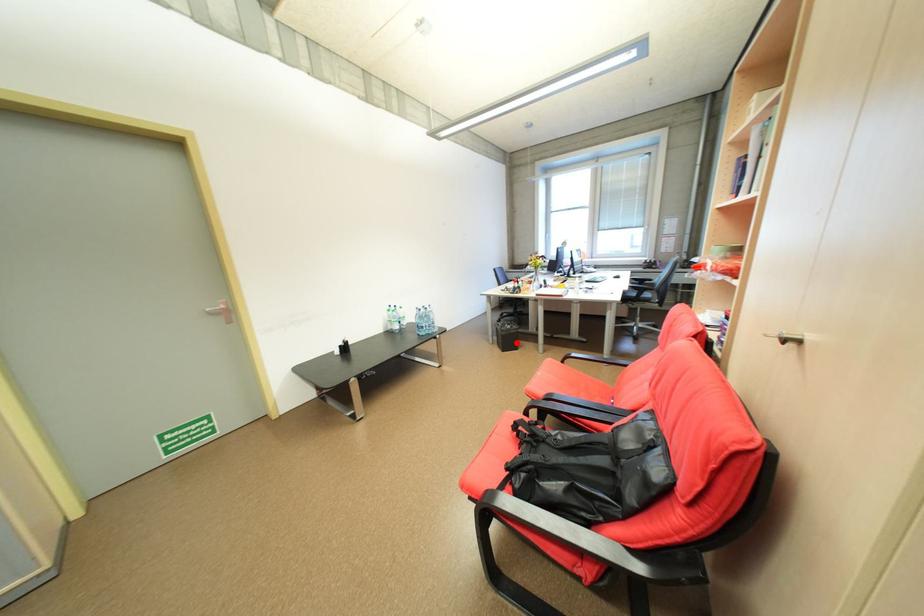
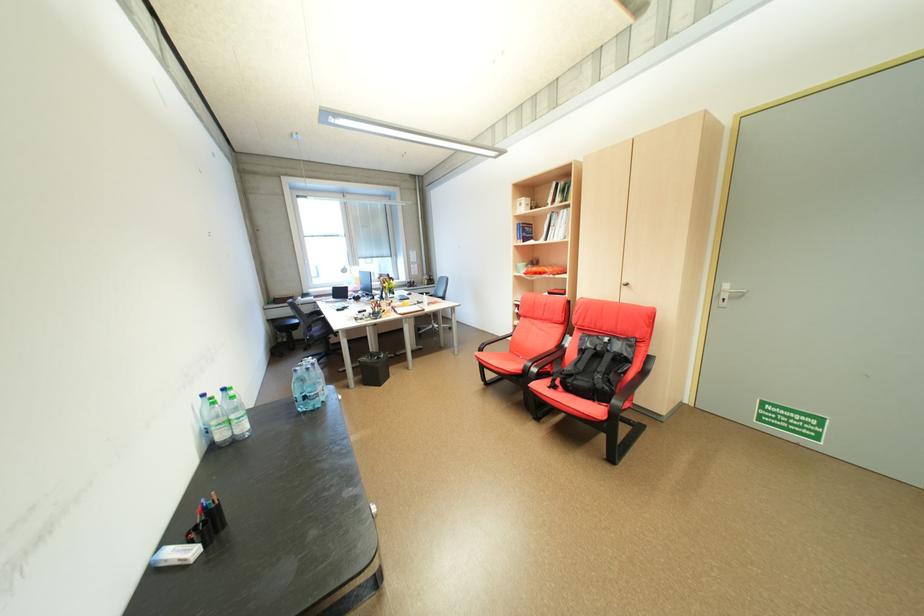
Question: I am providing you with two images of the same scene from different viewpoints. A red point is shown in image1. For the corresponding object point in image2, is it positioned nearer or farther from the camera?

Choices:
 (A) Nearer
 (B) Farther

Answer: (B)